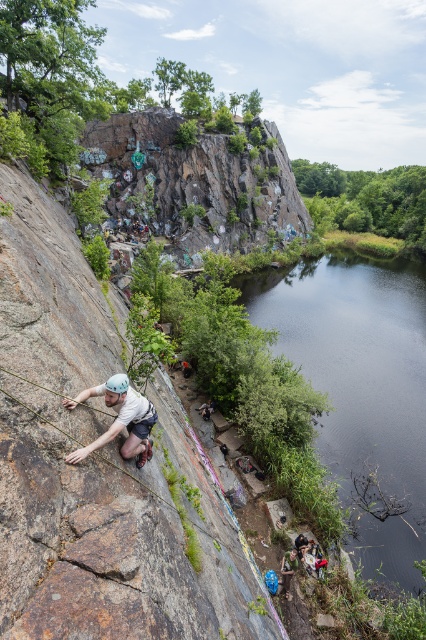
Between brown rough rock at left and blue rubber boots at lower center, which one has more height?

brown rough rock at left is taller.

Which is more to the right, brown rough rock at left or blue rubber boots at lower center?

blue rubber boots at lower center

Does point (54, 634) lie in front of point (282, 579)?

Yes.

Locate an element on the screen. The height and width of the screenshot is (640, 426). brown rough rock at left is located at coordinates (95, 467).

Does matte white helmet at left have a lesser width compared to blue rubber boots at lower center?

Incorrect, matte white helmet at left's width is not less than blue rubber boots at lower center's.

Does matte white helmet at left have a smaller size compared to blue rubber boots at lower center?

Actually, matte white helmet at left might be larger than blue rubber boots at lower center.

Is point (106, 440) closer to camera compared to point (293, 566)?

That is True.

Find the location of a particular element. matte white helmet at left is located at coordinates (118, 419).

Which is more to the right, brown rough rock at left or matte white helmet at left?

Positioned to the right is matte white helmet at left.

Between point (34, 259) and point (118, 432), which one is positioned in front?

Point (118, 432) is more forward.

Locate an element on the screen. The width and height of the screenshot is (426, 640). brown rough rock at left is located at coordinates (95, 467).